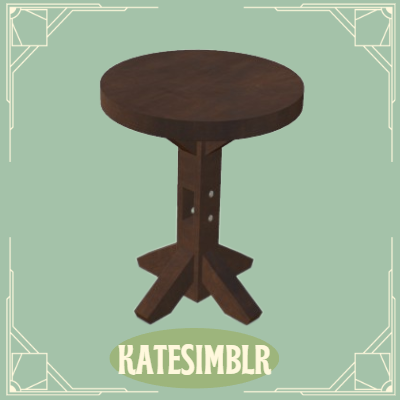
Locate an element on the screen. metal screws is located at coordinates (208, 218), (210, 194).